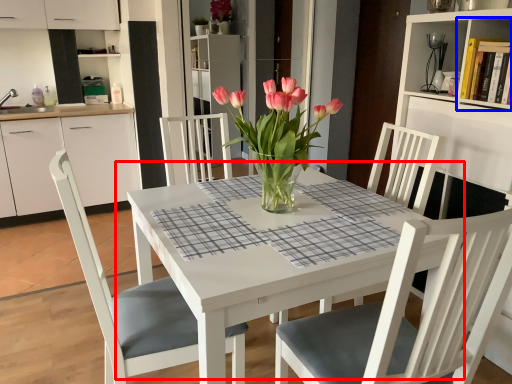
Question: Which object is closer to the camera taking this photo, kitchen & dining room table (highlighted by a red box) or shelf (highlighted by a blue box)?

Choices:
 (A) kitchen & dining room table
 (B) shelf

Answer: (A)